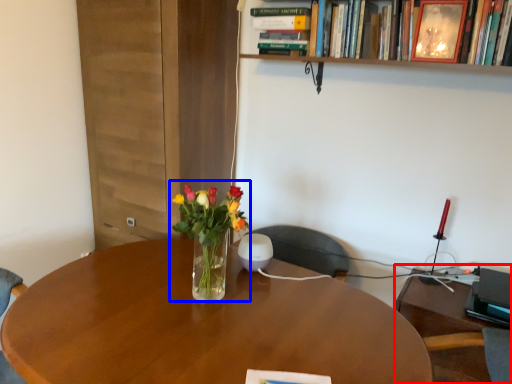
Question: Which object appears closest to the camera in this image, computer desk (highlighted by a red box) or floral arrangement (highlighted by a blue box)?

Choices:
 (A) computer desk
 (B) floral arrangement

Answer: (B)